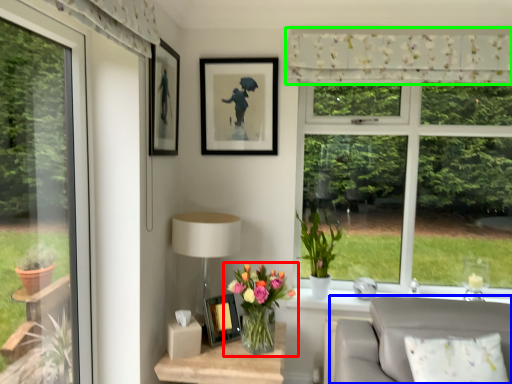
Question: Considering the real-world distances, which object is farthest from houseplant (highlighted by a red box)? studio couch (highlighted by a blue box) or curtain (highlighted by a green box)?

Choices:
 (A) studio couch
 (B) curtain

Answer: (B)